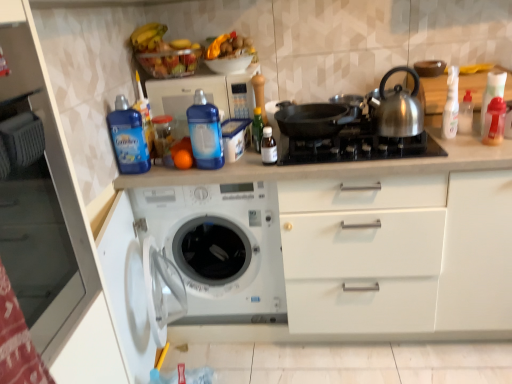
Find the location of a particular element. vacant space in between transparent plastic bottle at center, the 4th bottle in the right-to-left sequence, and blue translucent bottle at center, the 3th bottle from the left is located at coordinates (248, 165).